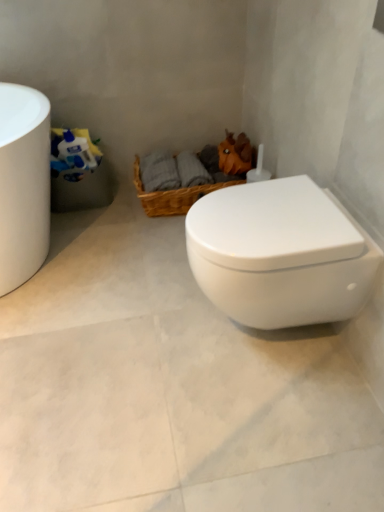
Question: Can you confirm if white glossy toilet paper at left is wider than white glossy toilet at center?

Choices:
 (A) no
 (B) yes

Answer: (A)

Question: Can you confirm if white glossy toilet paper at left is taller than white glossy toilet at center?

Choices:
 (A) no
 (B) yes

Answer: (B)

Question: Is white glossy toilet paper at left facing towards white glossy toilet at center?

Choices:
 (A) no
 (B) yes

Answer: (B)

Question: Does white glossy toilet paper at left lie in front of white glossy toilet at center?

Choices:
 (A) yes
 (B) no

Answer: (B)

Question: Is white glossy toilet paper at left at the right side of white glossy toilet at center?

Choices:
 (A) yes
 (B) no

Answer: (B)

Question: Is the surface of white glossy toilet paper at left in direct contact with white glossy toilet at center?

Choices:
 (A) no
 (B) yes

Answer: (A)

Question: Can you see white glossy toilet at center touching white glossy toilet at center?

Choices:
 (A) yes
 (B) no

Answer: (B)

Question: Can you confirm if white glossy toilet at center is positioned to the left of white glossy toilet at center?

Choices:
 (A) yes
 (B) no

Answer: (A)

Question: Is white glossy toilet at center not close to white glossy toilet at center?

Choices:
 (A) no
 (B) yes

Answer: (A)

Question: Can you confirm if white glossy toilet at center is taller than white glossy toilet at center?

Choices:
 (A) no
 (B) yes

Answer: (A)

Question: Does white glossy toilet at center appear on the right side of white glossy toilet at center?

Choices:
 (A) no
 (B) yes

Answer: (A)

Question: Can you confirm if white glossy toilet at center is bigger than white glossy toilet at center?

Choices:
 (A) no
 (B) yes

Answer: (B)

Question: Does white glossy toilet at center have a smaller size compared to woven brown basket at center?

Choices:
 (A) no
 (B) yes

Answer: (A)